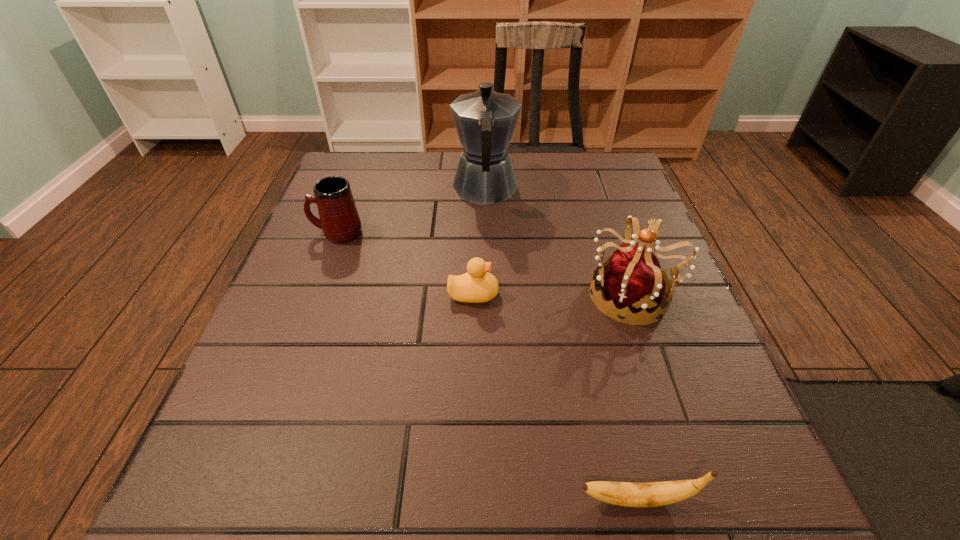
At what (x,y) coordinates should I click in order to perform the action: click on free space that is in between the nearest object and the duck. Please return your answer as a coordinate pair (x, y). Image resolution: width=960 pixels, height=540 pixels. Looking at the image, I should click on (555, 396).

Locate an element on the screen. The height and width of the screenshot is (540, 960). free area in between the leftmost object and the nearest object is located at coordinates (487, 366).

In order to click on vacant area that lies between the duck and the second farthest object in this screenshot , I will do `click(405, 264)`.

You are a GUI agent. You are given a task and a screenshot of the screen. Output one action in this format:
    pyautogui.click(x=<x>, y=<y>)
    Task: Click on the unoccupied area between the farthest object and the duck
    The width and height of the screenshot is (960, 540).
    Given the screenshot: What is the action you would take?
    pyautogui.click(x=479, y=242)

Identify the location of empty location between the fourth shortest object and the banana. Image resolution: width=960 pixels, height=540 pixels. (635, 397).

Find the location of a particular element. Image resolution: width=960 pixels, height=540 pixels. free point between the leftmost object and the duck is located at coordinates (405, 264).

The image size is (960, 540). Find the location of `vacant area between the duck and the second tallest object`. vacant area between the duck and the second tallest object is located at coordinates (553, 295).

The width and height of the screenshot is (960, 540). What are the coordinates of `empty space that is in between the third shortest object and the tallest object` in the screenshot? It's located at (411, 211).

Locate which object ranks fourth in proximity to the nearest object. Please provide its 2D coordinates. Your answer should be formatted as a tuple, i.e. [(x, y)], where the tuple contains the x and y coordinates of a point satisfying the conditions above.

[(340, 222)]

Find the location of a particular element. The height and width of the screenshot is (540, 960). object that is the third nearest to the leftmost object is located at coordinates (633, 280).